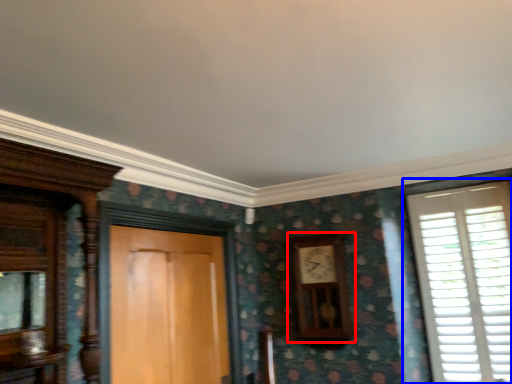
Question: Among these objects, which one is farthest to the camera, clock (highlighted by a red box) or window (highlighted by a blue box)?

Choices:
 (A) clock
 (B) window

Answer: (A)